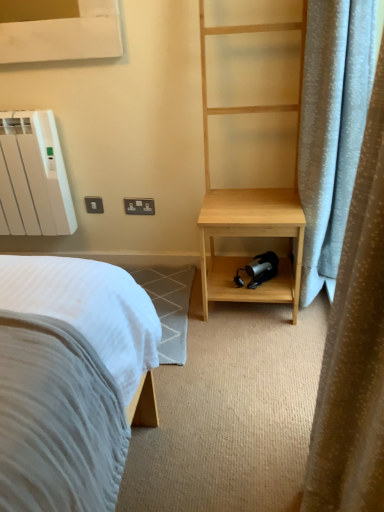
This screenshot has width=384, height=512. What do you see at coordinates (251, 121) in the screenshot? I see `natural wood bookshelf at right` at bounding box center [251, 121].

What are the coordinates of `white matte radiator at upper left` in the screenshot? It's located at [34, 176].

Measure the distance from white matte radiator at upper left to natural wood bookshelf at right.

white matte radiator at upper left is 33.31 inches away from natural wood bookshelf at right.

From the image's perspective, relative to natural wood bookshelf at right, is white matte radiator at upper left above or below?

white matte radiator at upper left is below natural wood bookshelf at right.

Considering the sizes of objects white matte radiator at upper left and natural wood bookshelf at right in the image provided, who is thinner, white matte radiator at upper left or natural wood bookshelf at right?

white matte radiator at upper left.

Is the surface of white matte radiator at upper left in direct contact with natural wood bookshelf at right?

No, white matte radiator at upper left is not in contact with natural wood bookshelf at right.

Which of these two, white matte radiator at upper left or light blue fabric curtain at right, is thinner?

white matte radiator at upper left.

Which object is further away from the camera, white matte radiator at upper left or light blue fabric curtain at right?

white matte radiator at upper left is behind.

How much distance is there between white matte radiator at upper left and light blue fabric curtain at right?

white matte radiator at upper left is 1.56 meters away from light blue fabric curtain at right.

Considering the sizes of objects white matte radiator at upper left and light blue fabric curtain at right in the image provided, who is taller, white matte radiator at upper left or light blue fabric curtain at right?

light blue fabric curtain at right is taller.

How many degrees apart are the facing directions of natural wood bookshelf at right and white plastic electric outlet at upper center?

1.65 degrees separate the facing orientations of natural wood bookshelf at right and white plastic electric outlet at upper center.

Measure the distance between natural wood bookshelf at right and white plastic electric outlet at upper center.

natural wood bookshelf at right is 24.37 inches from white plastic electric outlet at upper center.

Considering the sizes of objects natural wood bookshelf at right and white plastic electric outlet at upper center in the image provided, who is taller, natural wood bookshelf at right or white plastic electric outlet at upper center?

natural wood bookshelf at right.

Which is correct: natural wood bookshelf at right is inside white plastic electric outlet at upper center, or outside of it?

natural wood bookshelf at right exists outside the volume of white plastic electric outlet at upper center.

From a real-world perspective, between light blue fabric curtain at right and white plastic electric outlet at upper center, who is vertically higher?

From a 3D spatial view, light blue fabric curtain at right is above.

Considering their positions, is light blue fabric curtain at right located in front of or behind white plastic electric outlet at upper center?

Clearly, light blue fabric curtain at right is in front of white plastic electric outlet at upper center.

Is light blue fabric curtain at right oriented away from white plastic electric outlet at upper center?

That's not correct — light blue fabric curtain at right is not looking away from white plastic electric outlet at upper center.

Is light blue fabric curtain at right next to white plastic electric outlet at upper center and touching it?

light blue fabric curtain at right is not next to white plastic electric outlet at upper center, and they're not touching.

Looking at this image, measure the distance between white plastic electric outlet at upper center and white matte radiator at upper left.

The distance of white plastic electric outlet at upper center from white matte radiator at upper left is 17.54 inches.

Is white plastic electric outlet at upper center bigger or smaller than white matte radiator at upper left?

In the image, white plastic electric outlet at upper center appears to be smaller than white matte radiator at upper left.

From a real-world perspective, is white plastic electric outlet at upper center under white matte radiator at upper left?

Yes.

Does white plastic electric outlet at upper center touch white matte radiator at upper left?

white plastic electric outlet at upper center and white matte radiator at upper left are clearly separated.

From a real-world perspective, is natural wood bookshelf at right under light blue fabric curtain at right?

No, from a real-world perspective, natural wood bookshelf at right is not beneath light blue fabric curtain at right.

Is natural wood bookshelf at right taller or shorter than light blue fabric curtain at right?

natural wood bookshelf at right is taller than light blue fabric curtain at right.

Would you say natural wood bookshelf at right is inside or outside light blue fabric curtain at right?

natural wood bookshelf at right is not inside light blue fabric curtain at right, it's outside.

Choose the correct answer: Is white matte radiator at upper left inside white plastic electric outlet at upper center or outside it?

white matte radiator at upper left is not enclosed by white plastic electric outlet at upper center.

From the image's perspective, would you say white matte radiator at upper left is shown under white plastic electric outlet at upper center?

No.

Which is nearer, (46, 165) or (125, 202)?

Point (46, 165) appears to be closer to the viewer than point (125, 202).

From the picture: Based on their sizes in the image, would you say white matte radiator at upper left is bigger or smaller than white plastic electric outlet at upper center?

Clearly, white matte radiator at upper left is larger in size than white plastic electric outlet at upper center.

Find the location of a particular element. bookshelf above the white matte radiator at upper left (from a real-world perspective) is located at coordinates (251, 121).

Image resolution: width=384 pixels, height=512 pixels. I want to click on radiator behind the light blue fabric curtain at right, so click(34, 176).

Estimate the real-world distances between objects in this image. Which object is closer to light blue fabric curtain at right, white matte radiator at upper left or natural wood bookshelf at right?

Based on the image, natural wood bookshelf at right appears to be nearer to light blue fabric curtain at right.

From the picture: Looking at the image, which one is located closer to white plastic electric outlet at upper center, white matte radiator at upper left or light blue fabric curtain at right?

Based on the image, white matte radiator at upper left appears to be nearer to white plastic electric outlet at upper center.

Considering their positions, is light blue fabric curtain at right positioned closer to white matte radiator at upper left than white plastic electric outlet at upper center?

Among the two, white plastic electric outlet at upper center is located nearer to white matte radiator at upper left.

When comparing their distances from light blue fabric curtain at right, does natural wood bookshelf at right or white plastic electric outlet at upper center seem closer?

natural wood bookshelf at right is closer to light blue fabric curtain at right.

Estimate the real-world distances between objects in this image. Which object is further from white plastic electric outlet at upper center, light blue fabric curtain at right or natural wood bookshelf at right?

light blue fabric curtain at right is further to white plastic electric outlet at upper center.

When comparing their distances from light blue fabric curtain at right, does white plastic electric outlet at upper center or white matte radiator at upper left seem further?

white matte radiator at upper left is further to light blue fabric curtain at right.

Which object lies nearer to the anchor point white plastic electric outlet at upper center, light blue fabric curtain at right or white matte radiator at upper left?

Based on the image, white matte radiator at upper left appears to be nearer to white plastic electric outlet at upper center.

Looking at the image, which one is located further to natural wood bookshelf at right, light blue fabric curtain at right or white matte radiator at upper left?

Among the two, light blue fabric curtain at right is located further to natural wood bookshelf at right.

The height and width of the screenshot is (512, 384). What are the coordinates of `electric outlet between white matte radiator at upper left and natural wood bookshelf at right` in the screenshot? It's located at (139, 206).

Where is `bookshelf located between light blue fabric curtain at right and white matte radiator at upper left in the depth direction`? Image resolution: width=384 pixels, height=512 pixels. bookshelf located between light blue fabric curtain at right and white matte radiator at upper left in the depth direction is located at coordinates (251, 121).

Locate an element on the screen. The image size is (384, 512). radiator between light blue fabric curtain at right and white plastic electric outlet at upper center along the z-axis is located at coordinates (34, 176).

Image resolution: width=384 pixels, height=512 pixels. I want to click on bookshelf between light blue fabric curtain at right and white plastic electric outlet at upper center along the z-axis, so click(251, 121).